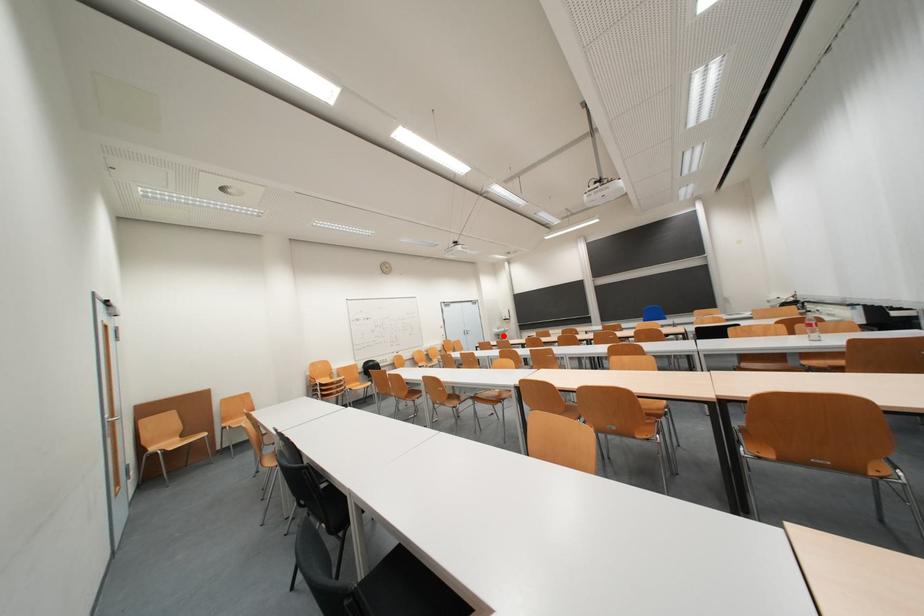
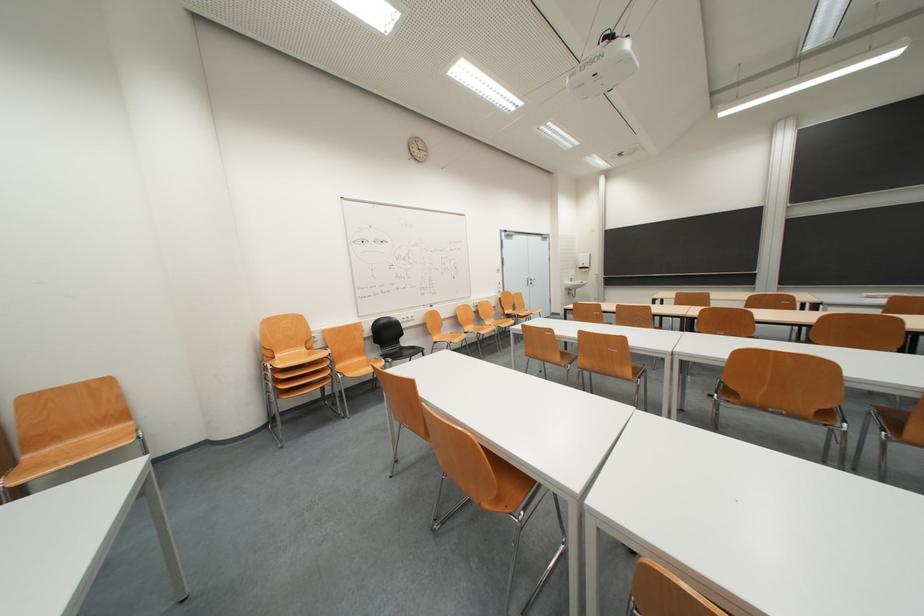
Where in the second image is the point corresponding to the highlighted location from the first image?

(575, 288)